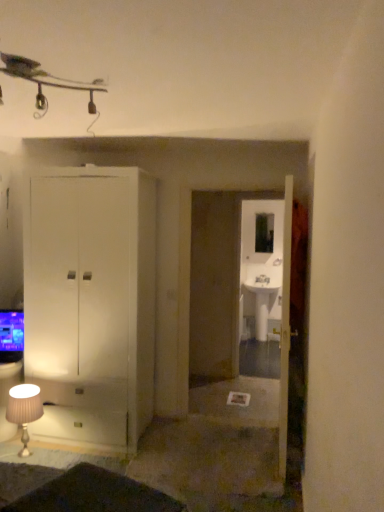
Question: Should I look upward or downward to see white glossy door at center?

Choices:
 (A) down
 (B) up

Answer: (A)

Question: Is white glossy sink at center taller than white glossy door at center?

Choices:
 (A) no
 (B) yes

Answer: (A)

Question: Can you confirm if white glossy sink at center is shorter than white glossy door at center?

Choices:
 (A) yes
 (B) no

Answer: (A)

Question: Is white glossy door at center surrounded by white glossy sink at center?

Choices:
 (A) no
 (B) yes

Answer: (A)

Question: Is there a large distance between white glossy sink at center and white glossy door at center?

Choices:
 (A) no
 (B) yes

Answer: (B)

Question: Is the surface of white glossy sink at center in direct contact with white glossy door at center?

Choices:
 (A) yes
 (B) no

Answer: (B)

Question: From the image's perspective, is white glossy sink at center above white glossy door at center?

Choices:
 (A) no
 (B) yes

Answer: (A)

Question: Could white glossy sink at center be considered to be inside white fabric lampshade at lower left?

Choices:
 (A) no
 (B) yes

Answer: (A)

Question: Is white fabric lampshade at lower left at the left side of white glossy sink at center?

Choices:
 (A) no
 (B) yes

Answer: (B)

Question: From the image's perspective, is white fabric lampshade at lower left over white glossy sink at center?

Choices:
 (A) no
 (B) yes

Answer: (A)

Question: Is white fabric lampshade at lower left not close to white glossy sink at center?

Choices:
 (A) yes
 (B) no

Answer: (A)

Question: Is white fabric lampshade at lower left oriented towards white glossy sink at center?

Choices:
 (A) no
 (B) yes

Answer: (A)

Question: Is white fabric lampshade at lower left not inside white glossy sink at center?

Choices:
 (A) no
 (B) yes

Answer: (B)

Question: Does white glossy sink at center lie in front of clear glass mirror at center?

Choices:
 (A) no
 (B) yes

Answer: (B)